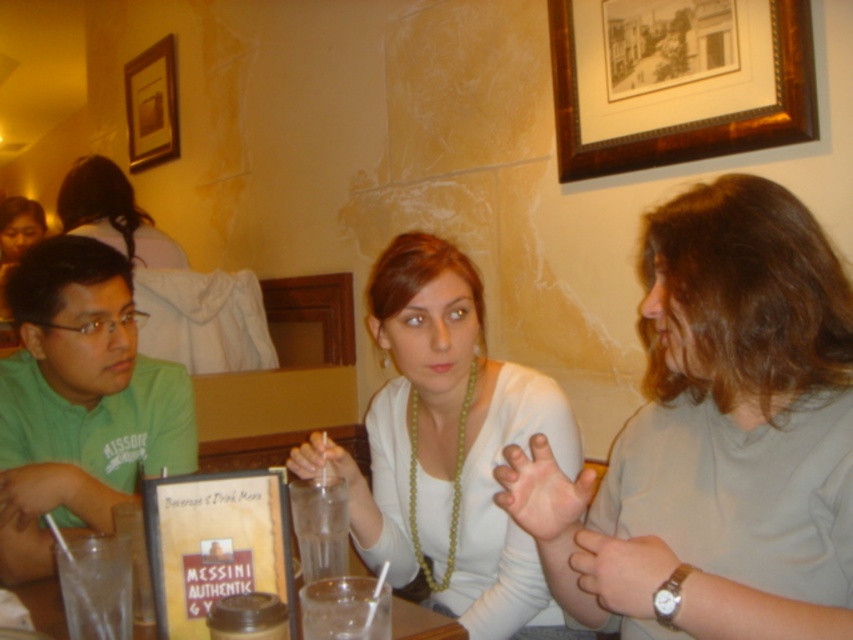
Question: Does green matte shirt at left appear over matte black hair at upper left?

Choices:
 (A) yes
 (B) no

Answer: (B)

Question: In this image, where is matte black hair at upper left located relative to clear plastic cup at center?

Choices:
 (A) right
 (B) left

Answer: (B)

Question: Which object appears closest to the camera in this image?

Choices:
 (A) brown wooden picture frame at upper right
 (B) matte plastic fork at lower left

Answer: (B)

Question: Does clear glass water at center come in front of clear plastic cup at center?

Choices:
 (A) yes
 (B) no

Answer: (A)

Question: Among these points, which one is nearest to the camera?

Choices:
 (A) (666, 330)
 (B) (550, 502)
 (C) (173, 470)

Answer: (B)

Question: Estimate the real-world distances between objects in this image. Which object is closer to the clear plastic cup at center?

Choices:
 (A) pale skin hand at center
 (B) white matte necklace at center

Answer: (B)